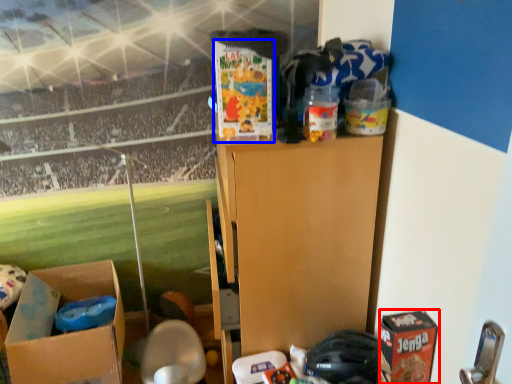
Question: Which object appears closest to the camera in this image, cardboard box (highlighted by a red box) or box (highlighted by a blue box)?

Choices:
 (A) cardboard box
 (B) box

Answer: (A)